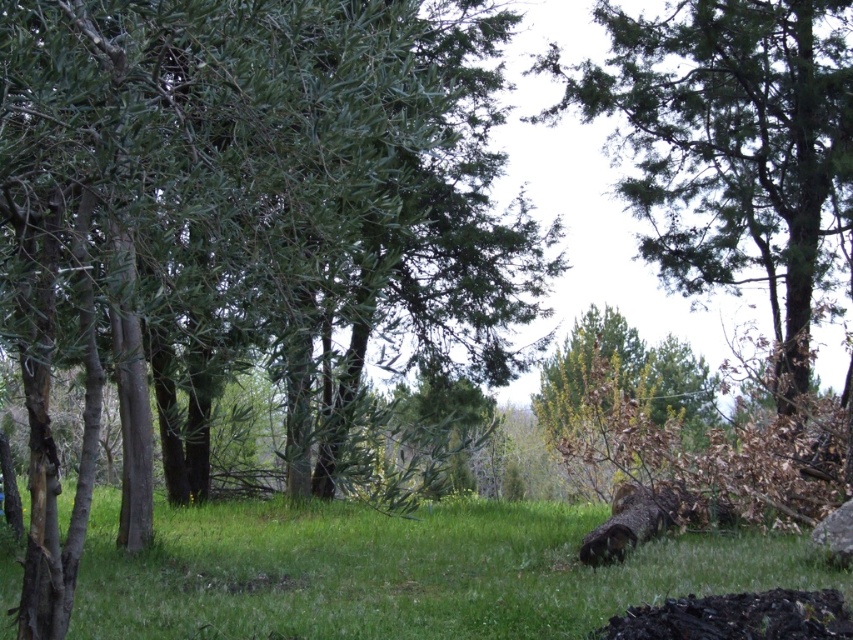
Question: Is green leafy tree at center thinner than green grassy at lower center?

Choices:
 (A) yes
 (B) no

Answer: (A)

Question: Based on their relative distances, which object is nearer to the green grassy at lower center?

Choices:
 (A) green leafy tree at upper right
 (B) green leafy tree at center

Answer: (B)

Question: Among these points, which one is nearest to the camera?

Choices:
 (A) (764, 538)
 (B) (553, 51)
 (C) (374, 483)

Answer: (C)

Question: Does green leafy tree at center have a greater width compared to green leafy tree at upper right?

Choices:
 (A) no
 (B) yes

Answer: (B)

Question: Observing the image, what is the correct spatial positioning of green grassy at lower center in reference to green leafy tree at upper right?

Choices:
 (A) right
 (B) left

Answer: (B)

Question: Which object is farther from the camera taking this photo?

Choices:
 (A) green leafy tree at center
 (B) green leafy tree at upper right

Answer: (B)